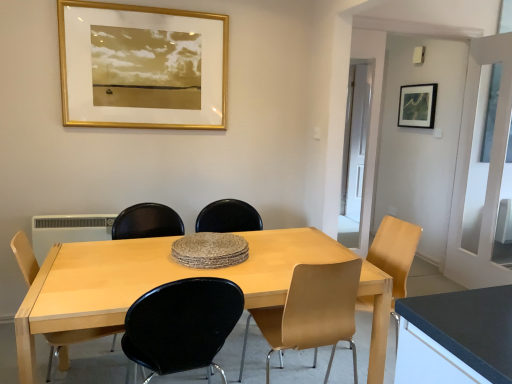
Where is `vacant area on top of gold/gilded picture frame at upper center, acting as the 2th picture frame starting from the back (from a real-world perspective)`? The image size is (512, 384). vacant area on top of gold/gilded picture frame at upper center, acting as the 2th picture frame starting from the back (from a real-world perspective) is located at coordinates (135, 6).